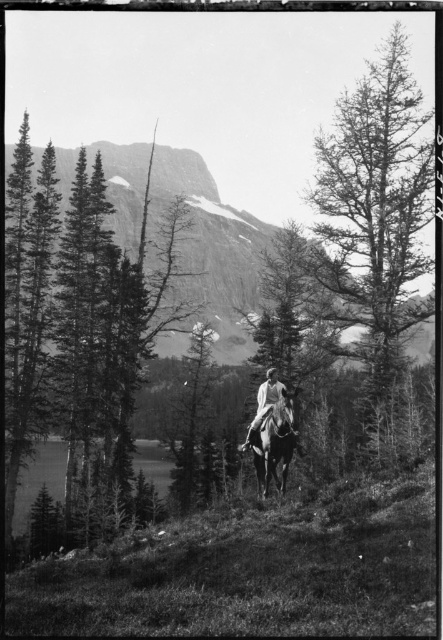
You are a photographer planning to take a photo of the smooth bark tree at center and the white glossy horse at center. If your camera has a maximum focus range of 100 feet, will both subjects be in focus at the same time?

The smooth bark tree at center and the white glossy horse at center are 122.31 feet apart. Since the distance between them exceeds the camera maximum focus range of 100 feet, both subjects cannot be in focus simultaneously.

In the black and white photo, there is a smooth bark tree at center and a white glossy horse at center. From the perspective of someone standing where the horse is, which object is located to their left?

The smooth bark tree at center is to the right of the white glossy horse at center, so from the horse and rider perspective, the smooth bark tree at center would be on their right side, meaning the left side would have nothing since the description only mentions the tree to the right.

You are a hiker trying to navigate through this mountainous area. You need to decide whether to climb the smooth bark tree at center or the rugged stone mountain at upper center. Based on their heights, which one would be taller and thus require more effort to climb?

The smooth bark tree at center is much taller than the rugged stone mountain at upper center, so climbing the smooth bark tree at center would require more effort.